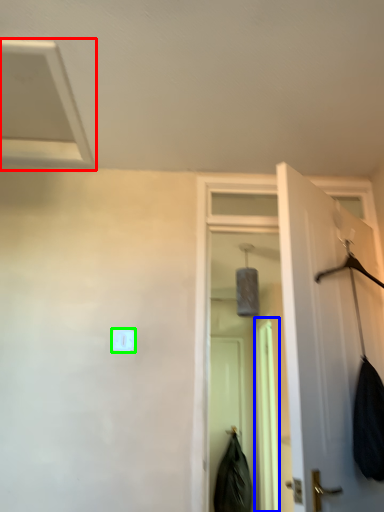
Question: Which object is the closest to the exhaust hood (highlighted by a red box)? Choose among these: screen door (highlighted by a blue box) or light switch (highlighted by a green box).

Choices:
 (A) screen door
 (B) light switch

Answer: (B)